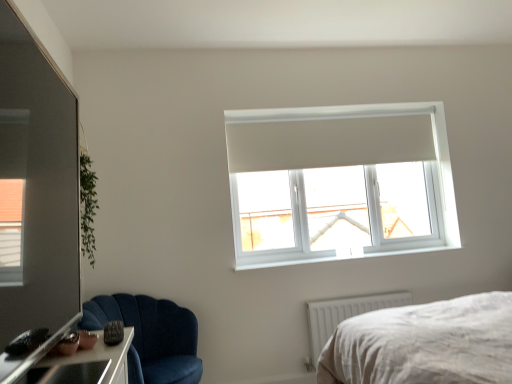
This screenshot has width=512, height=384. What do you see at coordinates (335, 211) in the screenshot?
I see `transparent plastic window at upper center` at bounding box center [335, 211].

This screenshot has height=384, width=512. In order to click on transparent plastic window at upper center in this screenshot , I will do `click(335, 211)`.

The height and width of the screenshot is (384, 512). In order to click on transparent glass door at left in this screenshot , I will do `click(36, 196)`.

Describe the element at coordinates (36, 196) in the screenshot. The height and width of the screenshot is (384, 512). I see `transparent glass door at left` at that location.

Locate an element on the screen. The height and width of the screenshot is (384, 512). white plastic window sill at upper center is located at coordinates (344, 257).

Find the location of `white plastic radiator at lower right`. white plastic radiator at lower right is located at coordinates (344, 315).

Can you confirm if white plastic radiator at lower right is positioned to the left of white plastic window sill at upper center?

No.

Is point (370, 296) behind point (256, 265)?

Yes, it is.

You are a GUI agent. You are given a task and a screenshot of the screen. Output one action in this format:
    pyautogui.click(x=<x>, y=<y>)
    Task: Click on the radiator in front of the white plastic window sill at upper center
    This screenshot has height=384, width=512.
    Given the screenshot: What is the action you would take?
    pyautogui.click(x=344, y=315)

Looking at this image, is white plastic radiator at lower right inside or outside of white plastic window sill at upper center?

white plastic radiator at lower right is not enclosed by white plastic window sill at upper center.

Which object is closer to the camera taking this photo, transparent plastic window at upper center or transparent glass door at left?

Positioned in front is transparent glass door at left.

Is transparent plastic window at upper center facing towards transparent glass door at left?

Yes, transparent plastic window at upper center is aimed at transparent glass door at left.

From the picture: Can you confirm if transparent plastic window at upper center is positioned to the right of transparent glass door at left?

Yes, transparent plastic window at upper center is to the right of transparent glass door at left.

Locate an element on the screen. window screen located on the right of transparent glass door at left is located at coordinates (335, 211).

From a real-world perspective, between white plastic radiator at lower right and transparent plastic window at upper center, who is vertically higher?

From a 3D spatial view, transparent plastic window at upper center is above.

Considering the relative positions of white plastic radiator at lower right and transparent plastic window at upper center in the image provided, is white plastic radiator at lower right to the left or to the right of transparent plastic window at upper center?

Based on their positions, white plastic radiator at lower right is located to the right of transparent plastic window at upper center.

Can you tell me how much white plastic radiator at lower right and transparent plastic window at upper center differ in facing direction?

The angle between the facing direction of white plastic radiator at lower right and the facing direction of transparent plastic window at upper center is 1.22 degrees.

Consider the image. In the image, is white plastic radiator at lower right positioned in front of or behind transparent plastic window at upper center?

Clearly, white plastic radiator at lower right is in front of transparent plastic window at upper center.

In terms of size, does white plastic window sill at upper center appear bigger or smaller than transparent glass door at left?

Considering their sizes, white plastic window sill at upper center takes up less space than transparent glass door at left.

Is transparent glass door at left surrounded by white plastic window sill at upper center?

Definitely not — transparent glass door at left is not inside white plastic window sill at upper center.

Does white plastic window sill at upper center have a lesser height compared to transparent glass door at left?

Correct, white plastic window sill at upper center is not as tall as transparent glass door at left.

From a real-world perspective, is white plastic window sill at upper center above or below transparent glass door at left?

In terms of real-world spatial position, white plastic window sill at upper center is below transparent glass door at left.

Is white plastic window sill at upper center situated inside transparent plastic window at upper center or outside?

white plastic window sill at upper center is not inside transparent plastic window at upper center, it's outside.

Is there a large distance between white plastic window sill at upper center and transparent plastic window at upper center?

No.

From the image's perspective, relative to transparent plastic window at upper center, is white plastic window sill at upper center above or below?

Based on their image positions, white plastic window sill at upper center is located beneath transparent plastic window at upper center.

Does white plastic window sill at upper center come behind transparent plastic window at upper center?

No, it is in front of transparent plastic window at upper center.

Between transparent plastic window at upper center and white plastic radiator at lower right, which one is positioned behind?

transparent plastic window at upper center is more distant.

Between transparent plastic window at upper center and white plastic radiator at lower right, which one has more height?

transparent plastic window at upper center.

Is transparent plastic window at upper center to the right of white plastic radiator at lower right from the viewer's perspective?

No, transparent plastic window at upper center is not to the right of white plastic radiator at lower right.

Would you consider transparent plastic window at upper center to be distant from white plastic radiator at lower right?

transparent plastic window at upper center is actually quite close to white plastic radiator at lower right.

Is velvet blue chair at lower left with transparent glass door at left?

No, velvet blue chair at lower left is not in contact with transparent glass door at left.

Locate an element on the screen. This screenshot has height=384, width=512. glass door above the velvet blue chair at lower left (from the image's perspective) is located at coordinates (36, 196).

In terms of height, does velvet blue chair at lower left look taller or shorter compared to transparent glass door at left?

Clearly, velvet blue chair at lower left is taller compared to transparent glass door at left.

Is velvet blue chair at lower left inside the boundaries of transparent glass door at left, or outside?

velvet blue chair at lower left cannot be found inside transparent glass door at left.

Identify the location of window sill that is above the white plastic radiator at lower right (from the image's perspective). The image size is (512, 384). (344, 257).

In the image, there is a transparent glass door at left. Where is `window screen below it (from the image's perspective)`? This screenshot has width=512, height=384. window screen below it (from the image's perspective) is located at coordinates (335, 211).

Estimate the real-world distances between objects in this image. Which object is further from transparent glass door at left, transparent plastic window at upper center or white plastic window sill at upper center?

transparent plastic window at upper center is positioned further to the anchor transparent glass door at left.

In the scene shown: When comparing their distances from white plastic radiator at lower right, does white plastic window sill at upper center or transparent glass door at left seem closer?

white plastic window sill at upper center lies closer to white plastic radiator at lower right than the other object.

Estimate the real-world distances between objects in this image. Which object is further from white plastic window sill at upper center, transparent plastic window at upper center or white plastic radiator at lower right?

white plastic radiator at lower right lies further to white plastic window sill at upper center than the other object.

From the image, which object appears to be farther from white plastic window sill at upper center, white plastic radiator at lower right or velvet blue chair at lower left?

The object further to white plastic window sill at upper center is velvet blue chair at lower left.

From the image, which object appears to be nearer to velvet blue chair at lower left, transparent glass door at left or white plastic window sill at upper center?

white plastic window sill at upper center is positioned closer to the anchor velvet blue chair at lower left.

Looking at the image, which one is located further to white plastic radiator at lower right, transparent plastic window at upper center or transparent glass door at left?

Based on the image, transparent glass door at left appears to be further to white plastic radiator at lower right.

Which object lies further to the anchor point transparent glass door at left, velvet blue chair at lower left or white plastic window sill at upper center?

Among the two, white plastic window sill at upper center is located further to transparent glass door at left.

When comparing their distances from transparent glass door at left, does velvet blue chair at lower left or white plastic radiator at lower right seem closer?

Based on the image, velvet blue chair at lower left appears to be nearer to transparent glass door at left.

Locate an element on the screen. This screenshot has width=512, height=384. window screen between velvet blue chair at lower left and white plastic radiator at lower right from left to right is located at coordinates (335, 211).

This screenshot has height=384, width=512. In order to click on radiator located between transparent glass door at left and white plastic window sill at upper center in the depth direction in this screenshot , I will do `click(344, 315)`.

Image resolution: width=512 pixels, height=384 pixels. Find the location of `radiator between transparent glass door at left and transparent plastic window at upper center in the front-back direction`. radiator between transparent glass door at left and transparent plastic window at upper center in the front-back direction is located at coordinates [344, 315].

Where is `chair between transparent glass door at left and transparent plastic window at upper center in the front-back direction`? chair between transparent glass door at left and transparent plastic window at upper center in the front-back direction is located at coordinates (151, 336).